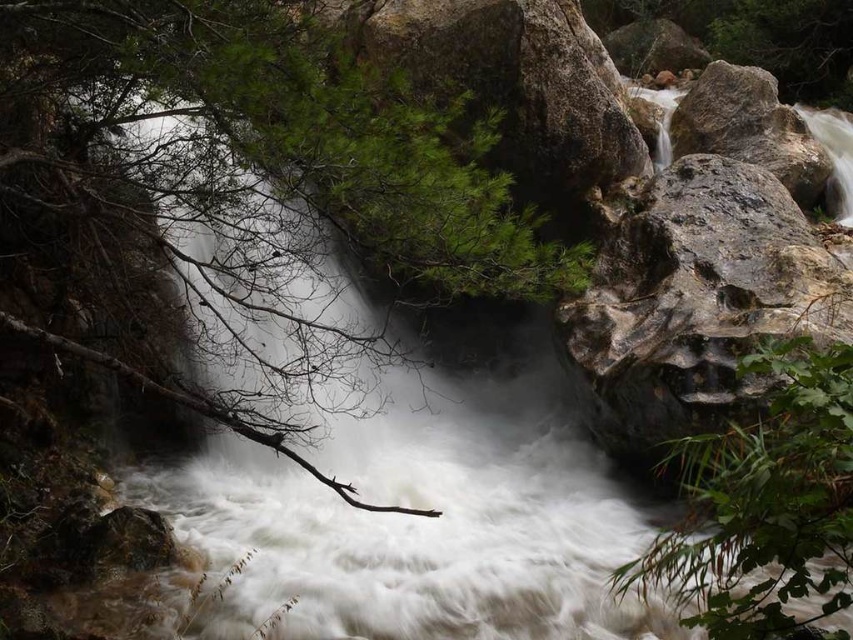
You are a hiker trying to cross the stream using the rough textured rock at right and the green leafy plant at lower right as landmarks. Which object is wider so you can judge your path?

The rough textured rock at right is wider than the green leafy plant at lower right, so you should use the rough textured rock at right as a wider landmark for your path.

You are a photographer standing at the edge of the waterfall. You notice two points marked in the scene. The first point is at coordinate point (142, 4), and the second point is at coordinate point (747, 518). Which point is closer to your camera lens?

Point (142, 4) is closer to the camera lens than point (747, 518) because it is further to the camera than the latter according to the description.

You are a hiker trying to determine the best path to cross the stream. You notice the green leafy tree at upper left and the green leafy plant at lower right. Which of these two plants is taller?

The green leafy tree at upper left is much taller than the green leafy plant at lower right, so the tree is taller.